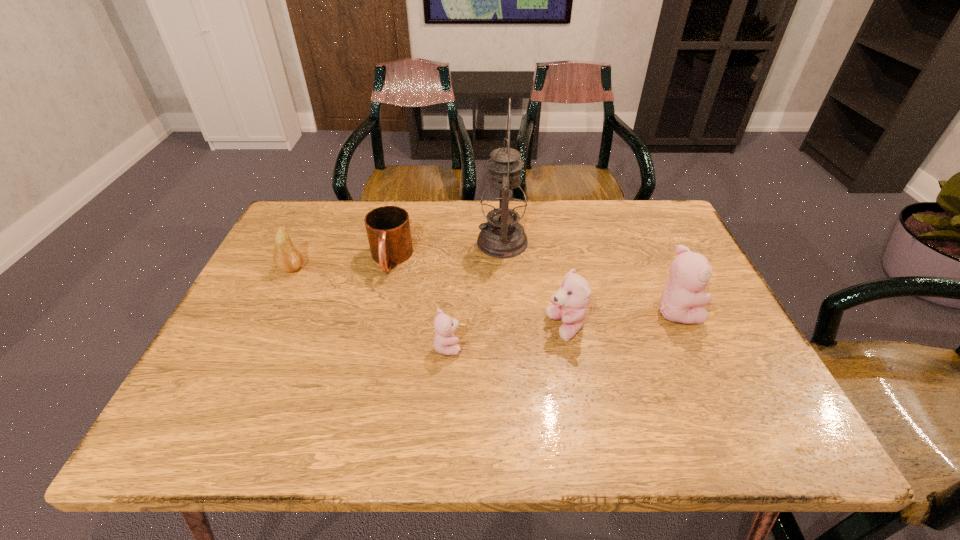
Image resolution: width=960 pixels, height=540 pixels. Identify the location of free space that is in between the fifth object from right to left and the second object from right to left. (478, 293).

The image size is (960, 540). I want to click on vacant area that lies between the second tallest teddy bear and the rightmost teddy bear, so click(621, 319).

Image resolution: width=960 pixels, height=540 pixels. Find the location of `free space between the oil lamp and the mug`. free space between the oil lamp and the mug is located at coordinates (446, 251).

Locate an element on the screen. The height and width of the screenshot is (540, 960). free space between the mug and the second teddy bear from left to right is located at coordinates (478, 293).

Image resolution: width=960 pixels, height=540 pixels. Identify the location of vacant space that is in between the oil lamp and the third object from left to right. (475, 294).

At what (x,y) coordinates should I click in order to perform the action: click on vacant space that is in between the fifth object from left to right and the rightmost teddy bear. Please return your answer as a coordinate pair (x, y). The width and height of the screenshot is (960, 540). Looking at the image, I should click on (621, 319).

Identify which object is located as the fourth nearest to the second tallest teddy bear. Please provide its 2D coordinates. Your answer should be formatted as a tuple, i.e. [(x, y)], where the tuple contains the x and y coordinates of a point satisfying the conditions above.

[(388, 229)]

Identify the location of the fifth closest object relative to the leftmost object. (681, 302).

Where is `teddy bear object that ranks as the second closest to the third object from left to right`? teddy bear object that ranks as the second closest to the third object from left to right is located at coordinates (681, 302).

You are a GUI agent. You are given a task and a screenshot of the screen. Output one action in this format:
    pyautogui.click(x=<x>, y=<y>)
    Task: Click on the teddy bear that is the closest one to the fifth object from left to right
    
    Given the screenshot: What is the action you would take?
    [x=681, y=302]